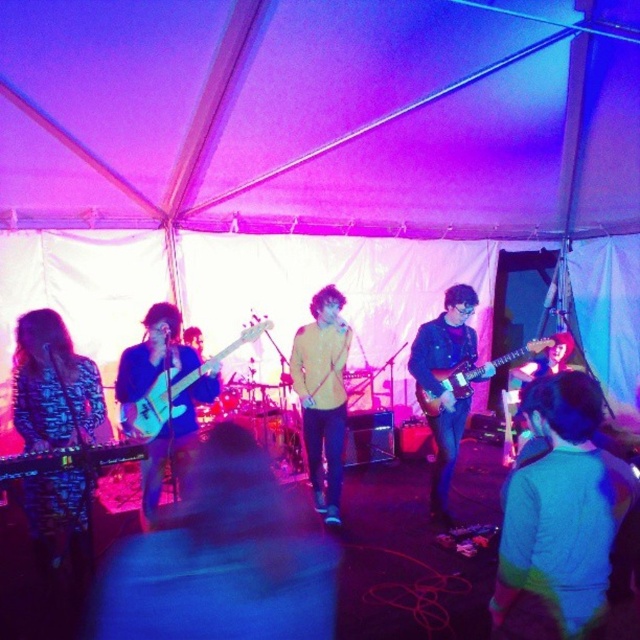
Question: Is printed fabric dress at left thinner than matte black guitar at center?

Choices:
 (A) yes
 (B) no

Answer: (A)

Question: Considering the relative positions of blue fabric jacket at lower right and printed fabric dress at left in the image provided, where is blue fabric jacket at lower right located with respect to printed fabric dress at left?

Choices:
 (A) right
 (B) left

Answer: (A)

Question: Which object is the closest to the denim jacket at center?

Choices:
 (A) yellow matte jacket at center
 (B) printed fabric dress at left
 (C) matte black guitar at center
 (D) blue fabric jacket at lower right

Answer: (A)

Question: Among these points, which one is nearest to the camera?

Choices:
 (A) (170, 435)
 (B) (138, 432)

Answer: (B)

Question: Which object is closer to the camera taking this photo?

Choices:
 (A) matte black guitar at center
 (B) blue denim jacket at center
 (C) matte black guitar at left

Answer: (B)

Question: Can you confirm if blue fabric jacket at lower right is smaller than matte white electric guitar at left?

Choices:
 (A) yes
 (B) no

Answer: (A)